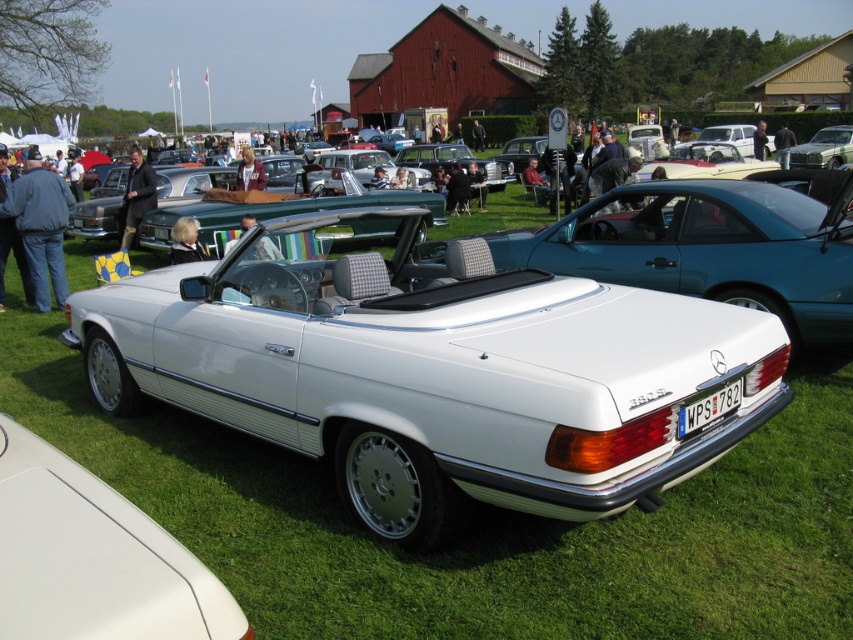
Is point (247, 227) positioned behind point (786, 163)?

That is False.

Looking at this image, does light brown leather jacket at center have a larger size compared to black leather jacket at center?

No, light brown leather jacket at center is not bigger than black leather jacket at center.

Measure the distance between light brown leather jacket at center and camera.

light brown leather jacket at center and camera are 4.40 meters apart from each other.

Locate an element on the screen. Image resolution: width=853 pixels, height=640 pixels. light brown leather jacket at center is located at coordinates (267, 250).

Where is `green grass at center`? The image size is (853, 640). green grass at center is located at coordinates (479, 524).

Is green grass at center wider than light brown leather jacket at center?

No, green grass at center is not wider than light brown leather jacket at center.

Is point (73, 422) closer to viewer compared to point (245, 230)?

Yes, point (73, 422) is closer to viewer.

Find the location of a particular element. Image resolution: width=853 pixels, height=640 pixels. green grass at center is located at coordinates (479, 524).

How distant is dark brown leather jacket at left from blonde hair at center?

11.94 meters

Between point (126, 224) and point (181, 244), which one is positioned behind?

The point (126, 224) is behind.

Which is in front, point (141, 208) or point (202, 257)?

Point (202, 257) is in front.

The width and height of the screenshot is (853, 640). I want to click on dark brown leather jacket at left, so click(x=136, y=196).